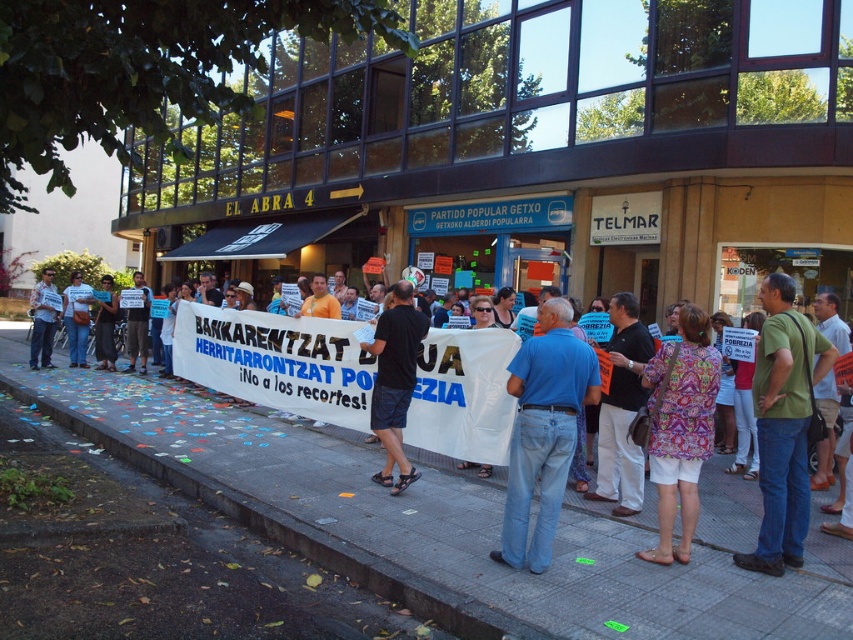
The image size is (853, 640). Describe the element at coordinates (543, 432) in the screenshot. I see `blue denim jeans at center` at that location.

Where is `blue denim jeans at center`? This screenshot has width=853, height=640. blue denim jeans at center is located at coordinates (543, 432).

Does gray concrete pavement at lower center appear on the left side of matte black shirt at left?

No, gray concrete pavement at lower center is not to the left of matte black shirt at left.

Between gray concrete pavement at lower center and matte black shirt at left, which one appears on the right side from the viewer's perspective?

gray concrete pavement at lower center is more to the right.

Which is in front, point (155, 419) or point (90, 285)?

Positioned in front is point (155, 419).

Where is `gray concrete pavement at lower center`? gray concrete pavement at lower center is located at coordinates (428, 524).

Describe the element at coordinates (395, 380) in the screenshot. I see `black fabric shorts at center` at that location.

Does black fabric shorts at center have a larger size compared to matte blue shirt at center?

No.

Between point (386, 337) and point (45, 342), which one is positioned behind?

Positioned behind is point (45, 342).

Find the location of a particular element. black fabric shorts at center is located at coordinates (395, 380).